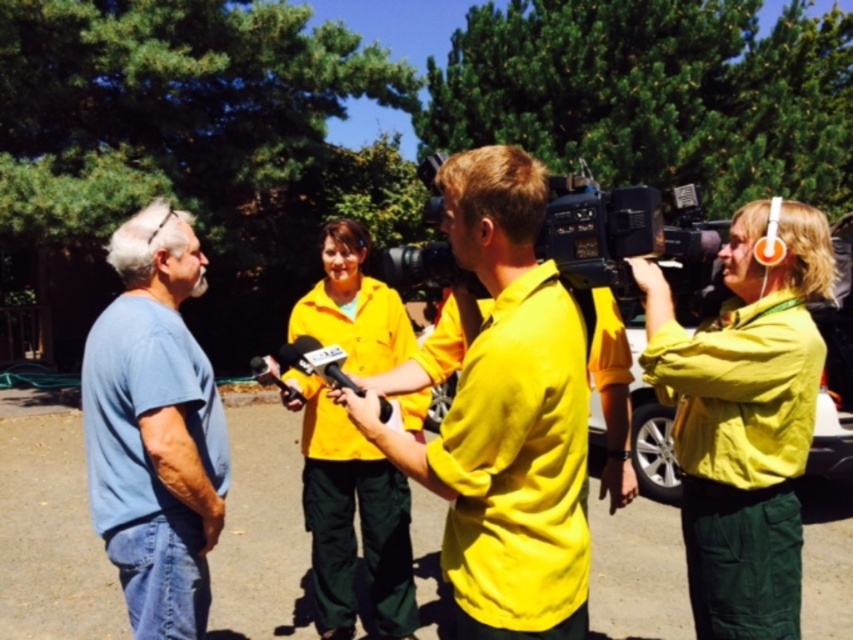
Question: Can you confirm if yellow matte shirt at center is bigger than black plastic video camera at center?

Choices:
 (A) yes
 (B) no

Answer: (A)

Question: Which point is farther from the camera taking this photo?

Choices:
 (A) (437, 260)
 (B) (160, 589)

Answer: (A)

Question: Which object is closer to the camera taking this photo?

Choices:
 (A) yellow matte shirt at center
 (B) black plastic video camera at center
 (C) blue cotton shirt at left

Answer: (A)

Question: Is yellow matte shirt at center bigger than black plastic video camera at center?

Choices:
 (A) no
 (B) yes

Answer: (B)

Question: Considering the relative positions of yellow matte shirt at center and black plastic video camera at center in the image provided, where is yellow matte shirt at center located with respect to black plastic video camera at center?

Choices:
 (A) above
 (B) below

Answer: (B)

Question: Based on their relative distances, which object is nearer to the blue cotton shirt at left?

Choices:
 (A) black plastic video camera at center
 (B) yellow matte shirt at center

Answer: (B)